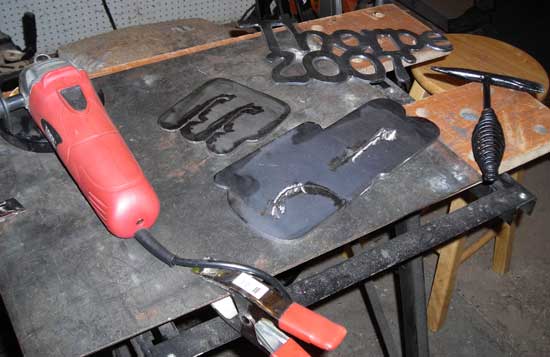
The image size is (550, 357). What are the coordinates of `left leg of stool` in the screenshot? It's located at (446, 284).